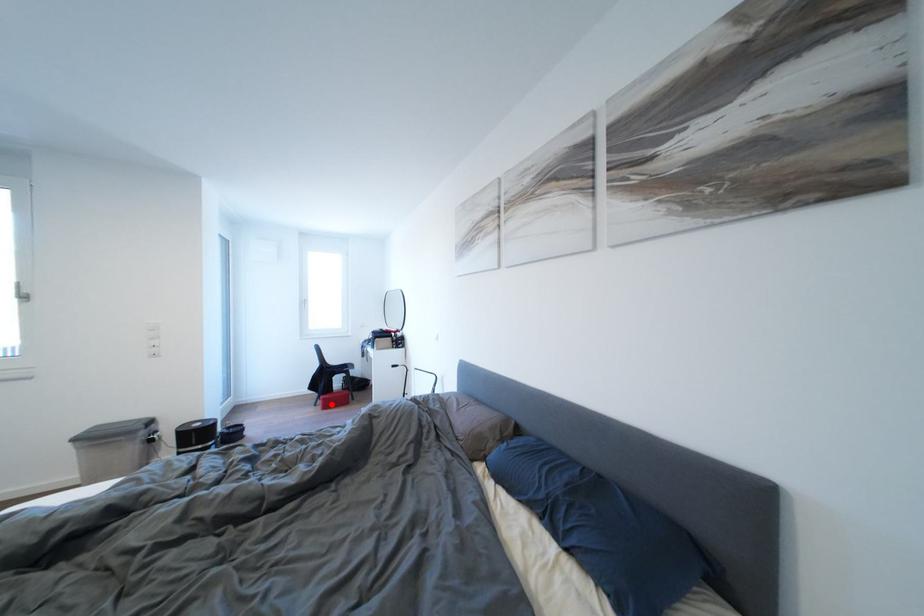
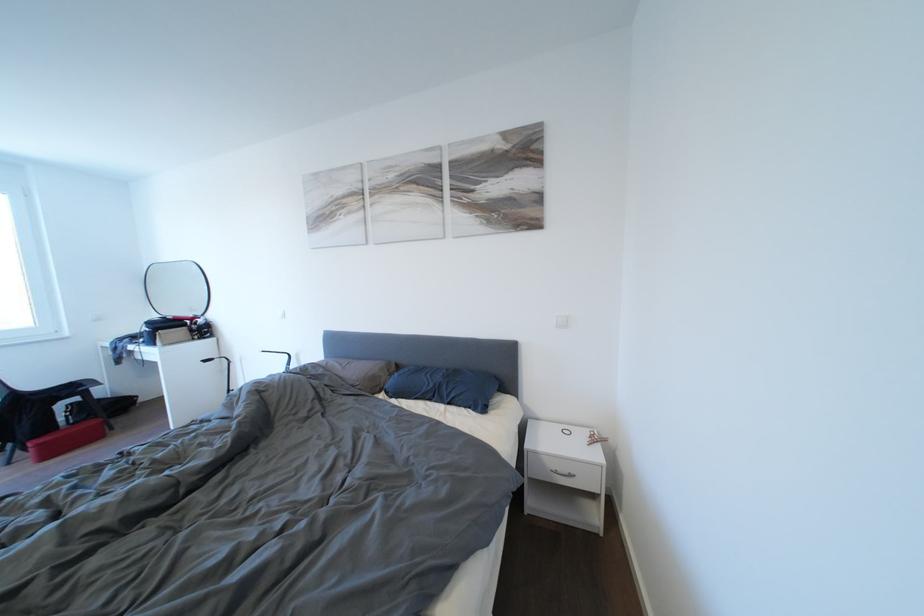
Question: I am providing you with two images of the same scene from different viewpoints. Image1 has a red point marked. In image2, the corresponding 3D location appears at what relative position? Reply with the corresponding letter.

Choices:
 (A) Closer
 (B) Farther

Answer: (A)